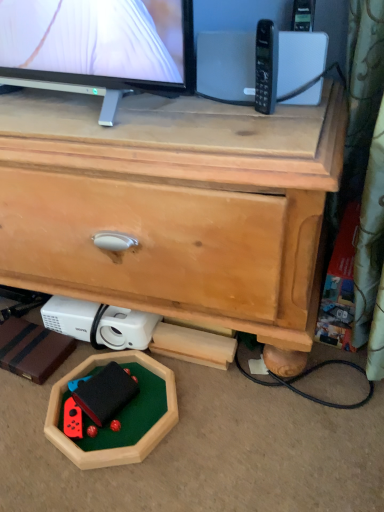
This screenshot has height=512, width=384. Find the location of `black plastic phone at upper right`. black plastic phone at upper right is located at coordinates (266, 66).

Describe the element at coordinates (266, 66) in the screenshot. I see `black plastic phone at upper right` at that location.

What is the approximate height of rubberized black toy at lower center?

rubberized black toy at lower center is 2.27 inches tall.

This screenshot has width=384, height=512. What do you see at coordinates (175, 208) in the screenshot? I see `wooden chest of drawers at center` at bounding box center [175, 208].

This screenshot has width=384, height=512. What do you see at coordinates (99, 323) in the screenshot?
I see `white plastic projector at lower left` at bounding box center [99, 323].

Find the location of a particular element. Image resolution: width=384 pixels, height=512 pixels. white plastic projector at lower left is located at coordinates (99, 323).

Where is `black plastic phone at upper right`? black plastic phone at upper right is located at coordinates (266, 66).

Between rubberized black toy at lower center and black plastic phone at upper right, which one has larger width?

rubberized black toy at lower center is wider.

Can we say rubberized black toy at lower center lies outside black plastic phone at upper right?

Yes, rubberized black toy at lower center is not within black plastic phone at upper right.

Between point (107, 421) and point (258, 80), which one is positioned in front?

The point (258, 80) is in front.

Can you confirm if rubberized black toy at lower center is bigger than black plastic phone at upper right?

Yes.

From a real-world perspective, is rubberized black toy at lower center under white plastic projector at lower left?

Yes.

Considering the sizes of objects rubberized black toy at lower center and white plastic projector at lower left in the image provided, who is wider, rubberized black toy at lower center or white plastic projector at lower left?

rubberized black toy at lower center is wider.

Is rubberized black toy at lower center situated inside white plastic projector at lower left or outside?

rubberized black toy at lower center is not enclosed by white plastic projector at lower left.

Is rubberized black toy at lower center taller or shorter than white plastic projector at lower left?

Clearly, rubberized black toy at lower center is shorter compared to white plastic projector at lower left.

The width and height of the screenshot is (384, 512). In the image, there is a white plastic projector at lower left. Find the location of `control above it (from the image's perspective)`. control above it (from the image's perspective) is located at coordinates 266,66.

Based on the photo, considering the relative positions of black plastic phone at upper right and white plastic projector at lower left in the image provided, is black plastic phone at upper right to the left or to the right of white plastic projector at lower left?

From the image, it's evident that black plastic phone at upper right is to the right of white plastic projector at lower left.

How different are the orientations of black plastic phone at upper right and white plastic projector at lower left in degrees?

The angle between the facing direction of black plastic phone at upper right and the facing direction of white plastic projector at lower left is 35.2 degrees.

Is black plastic phone at upper right aimed at white plastic projector at lower left?

No.

Which object is closer to the camera, black plastic phone at upper right or wooden chest of drawers at center?

wooden chest of drawers at center is closer to the camera.

From the image's perspective, is black plastic phone at upper right above or below wooden chest of drawers at center?

From the image's perspective, black plastic phone at upper right appears above wooden chest of drawers at center.

Which is more to the right, black plastic phone at upper right or wooden chest of drawers at center?

black plastic phone at upper right is more to the right.

Does point (267, 79) come closer to viewer compared to point (85, 173)?

No.

From the image's perspective, is wooden chest of drawers at center above white plastic projector at lower left?

Correct, wooden chest of drawers at center appears higher than white plastic projector at lower left in the image.

Is wooden chest of drawers at center aimed at white plastic projector at lower left?

Yes, wooden chest of drawers at center is facing white plastic projector at lower left.

Is wooden chest of drawers at center completely or partially outside of white plastic projector at lower left?

Yes.

Identify the location of appliance above the rubberized black toy at lower center (from the image's perspective). The image size is (384, 512). (99, 323).

Is white plastic projector at lower left closer to camera compared to rubberized black toy at lower center?

No, white plastic projector at lower left is further to the viewer.

Could you tell me if white plastic projector at lower left is facing rubberized black toy at lower center?

Yes.

From a real-world perspective, is white plastic projector at lower left physically below rubberized black toy at lower center?

No.

Would you say wooden chest of drawers at center is part of rubberized black toy at lower center's contents?

That's incorrect, wooden chest of drawers at center is not inside rubberized black toy at lower center.

Can you confirm if rubberized black toy at lower center is bigger than wooden chest of drawers at center?

Actually, rubberized black toy at lower center might be smaller than wooden chest of drawers at center.

Considering the points (96, 404) and (233, 130), which point is behind, point (96, 404) or point (233, 130)?

Point (96, 404)

Considering the sizes of objects rubberized black toy at lower center and wooden chest of drawers at center in the image provided, who is thinner, rubberized black toy at lower center or wooden chest of drawers at center?

rubberized black toy at lower center.

You are a GUI agent. You are given a task and a screenshot of the screen. Output one action in this format:
    pyautogui.click(x=<x>, y=<y>)
    Task: Click on the control on the right side of rubberized black toy at lower center
    The width and height of the screenshot is (384, 512).
    Given the screenshot: What is the action you would take?
    pyautogui.click(x=266, y=66)

At what (x,y) coordinates should I click in order to perform the action: click on appliance to the left of rubberized black toy at lower center. Please return your answer as a coordinate pair (x, y). Image resolution: width=384 pixels, height=512 pixels. Looking at the image, I should click on (99, 323).

From the image, which object appears to be nearer to rubberized black toy at lower center, wooden chest of drawers at center or white plastic projector at lower left?

Based on the image, white plastic projector at lower left appears to be nearer to rubberized black toy at lower center.

When comparing their distances from wooden chest of drawers at center, does rubberized black toy at lower center or black plastic phone at upper right seem closer?

The object closer to wooden chest of drawers at center is black plastic phone at upper right.

From the image, which object appears to be farther from rubberized black toy at lower center, black plastic phone at upper right or wooden chest of drawers at center?

The object further to rubberized black toy at lower center is black plastic phone at upper right.

Looking at the image, which one is located closer to white plastic projector at lower left, wooden chest of drawers at center or black plastic phone at upper right?

The object closer to white plastic projector at lower left is wooden chest of drawers at center.

Estimate the real-world distances between objects in this image. Which object is closer to wooden chest of drawers at center, white plastic projector at lower left or black plastic phone at upper right?

Among the two, white plastic projector at lower left is located nearer to wooden chest of drawers at center.

Estimate the real-world distances between objects in this image. Which object is closer to wooden chest of drawers at center, black plastic phone at upper right or white plastic projector at lower left?

The object closer to wooden chest of drawers at center is white plastic projector at lower left.

Looking at the image, which one is located further to rubberized black toy at lower center, wooden chest of drawers at center or black plastic phone at upper right?

Based on the image, black plastic phone at upper right appears to be further to rubberized black toy at lower center.

In the scene shown: When comparing their distances from white plastic projector at lower left, does wooden chest of drawers at center or rubberized black toy at lower center seem closer?

rubberized black toy at lower center is positioned closer to the anchor white plastic projector at lower left.

The height and width of the screenshot is (512, 384). I want to click on chest of drawers between black plastic phone at upper right and white plastic projector at lower left from top to bottom, so click(175, 208).

Identify the location of appliance between wooden chest of drawers at center and rubberized black toy at lower center from top to bottom. (99, 323).

The height and width of the screenshot is (512, 384). Identify the location of appliance between black plastic phone at upper right and rubberized black toy at lower center vertically. (99, 323).

The image size is (384, 512). In order to click on chest of drawers between black plastic phone at upper right and rubberized black toy at lower center from top to bottom in this screenshot , I will do `click(175, 208)`.